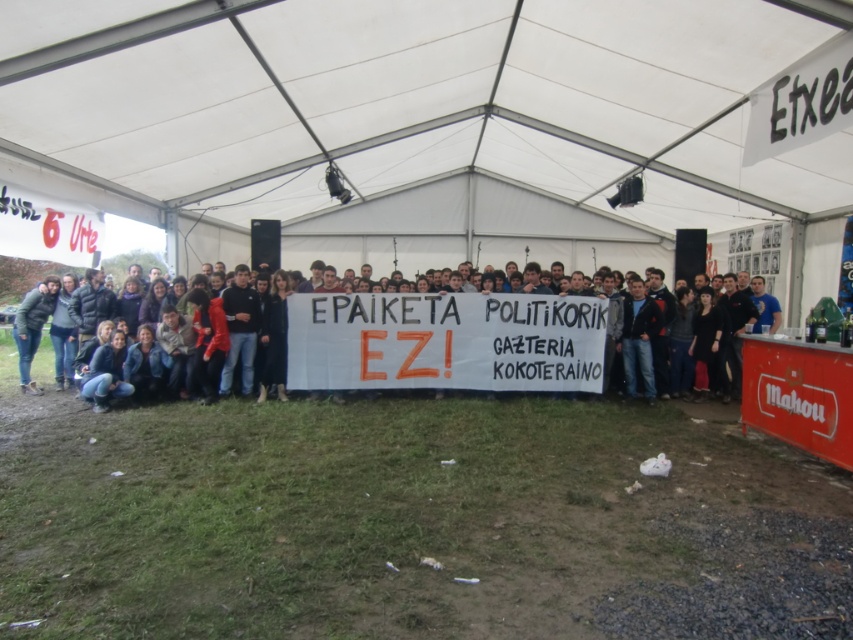
Is white fabric canopy at center smaller than white paper banner at center?

Incorrect, white fabric canopy at center is not smaller in size than white paper banner at center.

Identify the location of white fabric canopy at center. Image resolution: width=853 pixels, height=640 pixels. (416, 99).

What are the coordinates of `white fabric canopy at center` in the screenshot? It's located at (416, 99).

From the picture: Can you confirm if white paper banner at center is smaller than dark brown leather jacket at center?

Yes, white paper banner at center is smaller than dark brown leather jacket at center.

Can you confirm if white paper banner at center is bigger than dark brown leather jacket at center?

Incorrect, white paper banner at center is not larger than dark brown leather jacket at center.

Describe the element at coordinates (445, 340) in the screenshot. The width and height of the screenshot is (853, 640). I see `white paper banner at center` at that location.

You are a GUI agent. You are given a task and a screenshot of the screen. Output one action in this format:
    pyautogui.click(x=<x>, y=<y>)
    Task: Click on the white paper banner at center
    The width and height of the screenshot is (853, 640).
    Given the screenshot: What is the action you would take?
    pyautogui.click(x=445, y=340)

Can you confirm if white fabric canopy at center is smaller than dark brown leather jacket at center?

No.

Does point (386, 104) lie in front of point (540, 314)?

Yes, point (386, 104) is closer to viewer.

Which is behind, point (129, 99) or point (428, 348)?

Positioned behind is point (428, 348).

You are a GUI agent. You are given a task and a screenshot of the screen. Output one action in this format:
    pyautogui.click(x=<x>, y=<y>)
    Task: Click on the white fabric canopy at center
    
    Given the screenshot: What is the action you would take?
    pyautogui.click(x=416, y=99)